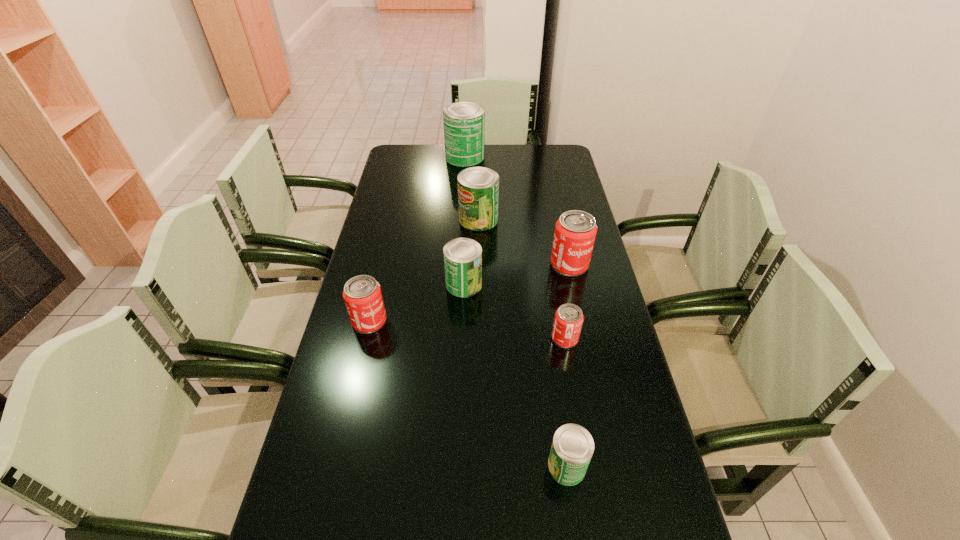
You are a GUI agent. You are given a task and a screenshot of the screen. Output one action in this format:
    pyautogui.click(x=<x>, y=<y>)
    Task: Click on the farthest green can
    The image size is (960, 540).
    Given the screenshot: What is the action you would take?
    pyautogui.click(x=463, y=122)

Locate an element on the screen. the tallest can is located at coordinates (463, 122).

Where is `the second farthest object`? Image resolution: width=960 pixels, height=540 pixels. the second farthest object is located at coordinates (478, 187).

You are a GUI agent. You are given a task and a screenshot of the screen. Output one action in this format:
    pyautogui.click(x=<x>, y=<y>)
    Task: Click on the third smallest green can
    
    Given the screenshot: What is the action you would take?
    pyautogui.click(x=478, y=187)

The image size is (960, 540). In order to click on the farthest red can in this screenshot , I will do `click(575, 231)`.

Where is `the second biggest red can`? The width and height of the screenshot is (960, 540). the second biggest red can is located at coordinates (362, 294).

Find the location of `the leftmost object`. the leftmost object is located at coordinates (362, 294).

This screenshot has height=540, width=960. I want to click on the second smallest green can, so click(462, 256).

Find the location of a particular element. the smallest red can is located at coordinates (568, 321).

Identify the location of the smallest green can. (572, 448).